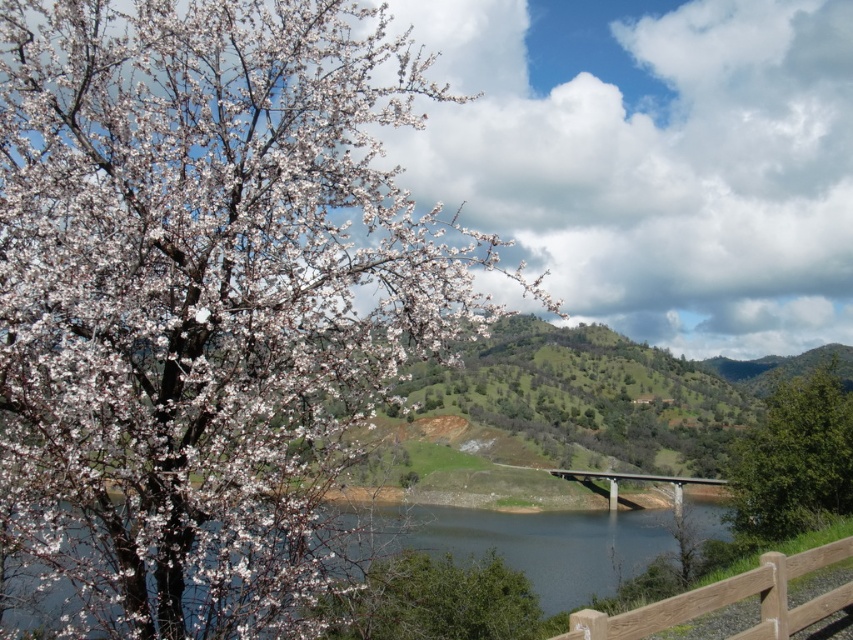
Is white matte flower at upper left to the left of green leafy tree at lower center from the viewer's perspective?

Correct, you'll find white matte flower at upper left to the left of green leafy tree at lower center.

Is white matte flower at upper left below green leafy tree at lower center?

No, white matte flower at upper left is not below green leafy tree at lower center.

Find the location of a particular element. white matte flower at upper left is located at coordinates (202, 296).

Locate an element on the screen. The height and width of the screenshot is (640, 853). white matte flower at upper left is located at coordinates (202, 296).

Is point (209, 547) closer to camera compared to point (645, 477)?

Yes, it is in front of point (645, 477).

What do you see at coordinates (202, 296) in the screenshot?
I see `white matte flower at upper left` at bounding box center [202, 296].

Locate an element on the screen. The width and height of the screenshot is (853, 640). white matte flower at upper left is located at coordinates (202, 296).

Is green leafy tree at right wider than brown wooden fence at lower right?

Yes, green leafy tree at right is wider than brown wooden fence at lower right.

Does green leafy tree at right have a lesser width compared to brown wooden fence at lower right?

In fact, green leafy tree at right might be wider than brown wooden fence at lower right.

Locate an element on the screen. green leafy tree at right is located at coordinates (793, 458).